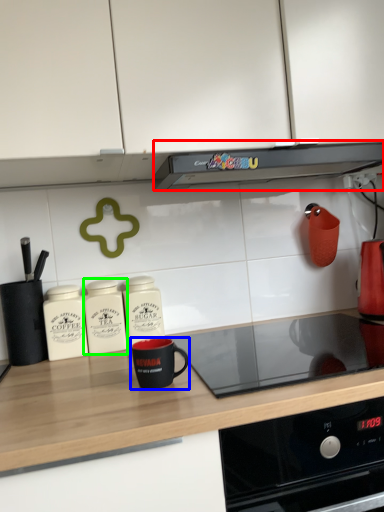
Question: Which is farther away from kitchen appliance (highlighted by a red box)? kitchen appliance (highlighted by a blue box) or kitchen appliance (highlighted by a green box)?

Choices:
 (A) kitchen appliance
 (B) kitchen appliance

Answer: (A)